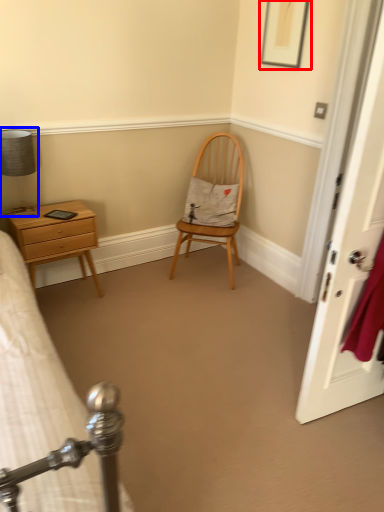
Question: Which object appears closest to the camera in this image, picture frame (highlighted by a red box) or bedside lamp (highlighted by a blue box)?

Choices:
 (A) picture frame
 (B) bedside lamp

Answer: (B)